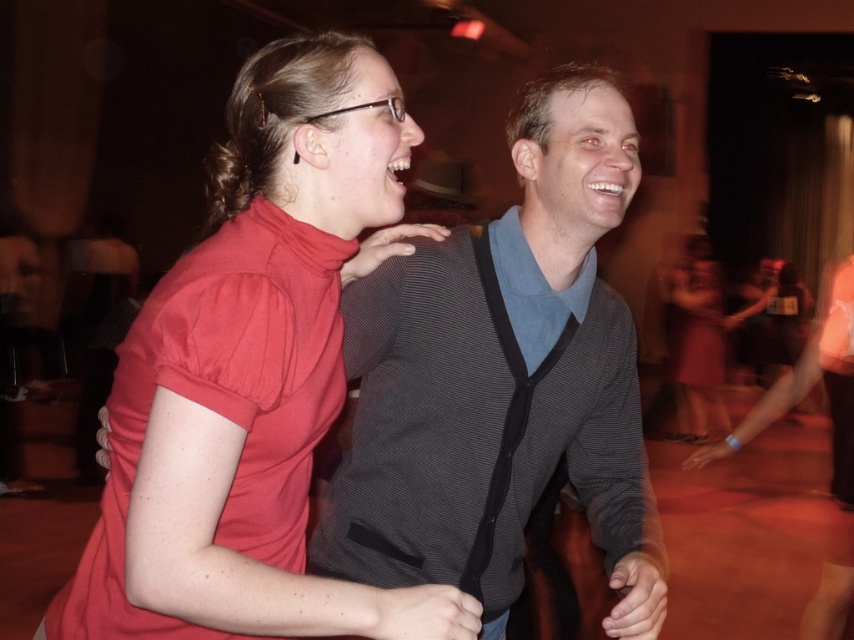
Which is more to the left, matte red turtleneck at upper left or matte red dress at lower right?

From the viewer's perspective, matte red turtleneck at upper left appears more on the left side.

Does matte red turtleneck at upper left appear under matte red dress at lower right?

No, matte red turtleneck at upper left is not below matte red dress at lower right.

Who is more distant from viewer, [358,632] or [714,401]?

Point [714,401]

Where is `matte red turtleneck at upper left`? The width and height of the screenshot is (854, 640). matte red turtleneck at upper left is located at coordinates (255, 374).

Does gray textured sweater at center come behind matte red dress at lower right?

No, it is not.

Is point (609, 419) behind point (699, 276)?

That is False.

Image resolution: width=854 pixels, height=640 pixels. Find the location of `gray textured sweater at center`. gray textured sweater at center is located at coordinates (502, 380).

Is point (373, 83) positioned before point (424, 538)?

That is True.

Is matte red turtleneck at upper left to the left of gray textured sweater at center from the viewer's perspective?

Correct, you'll find matte red turtleneck at upper left to the left of gray textured sweater at center.

This screenshot has height=640, width=854. What are the coordinates of `matte red turtleneck at upper left` in the screenshot? It's located at (255, 374).

Locate an element on the screen. matte red turtleneck at upper left is located at coordinates (255, 374).